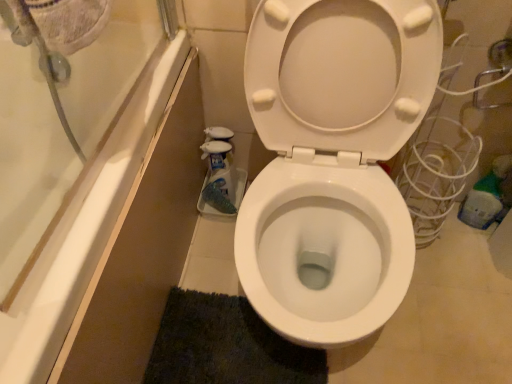
Question: Is dark blue textured bath mat at lower center in front of or behind white glossy toilet at center in the image?

Choices:
 (A) front
 (B) behind

Answer: (B)

Question: Looking at the image, does dark blue textured bath mat at lower center seem bigger or smaller compared to white glossy toilet at center?

Choices:
 (A) small
 (B) big

Answer: (A)

Question: Does point (220, 294) appear closer or farther from the camera than point (327, 137)?

Choices:
 (A) closer
 (B) farther

Answer: (B)

Question: Considering the positions of white glossy toilet at center and dark blue textured bath mat at lower center in the image, is white glossy toilet at center bigger or smaller than dark blue textured bath mat at lower center?

Choices:
 (A) small
 (B) big

Answer: (B)

Question: Would you say white glossy toilet at center is inside or outside dark blue textured bath mat at lower center?

Choices:
 (A) inside
 (B) outside

Answer: (B)

Question: From the image's perspective, is white glossy toilet at center positioned above or below dark blue textured bath mat at lower center?

Choices:
 (A) below
 (B) above

Answer: (B)

Question: From a real-world perspective, is white glossy toilet at center above or below dark blue textured bath mat at lower center?

Choices:
 (A) above
 (B) below

Answer: (A)